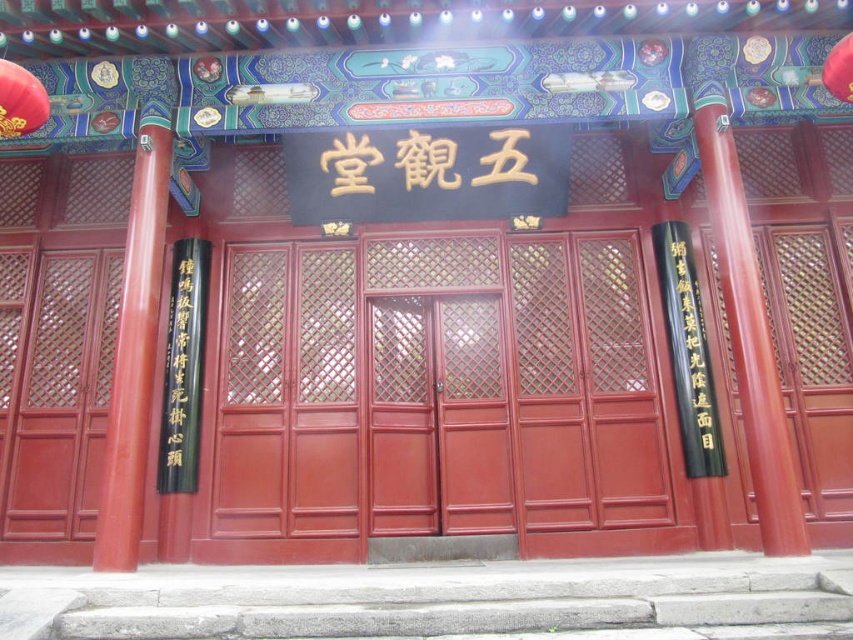
Question: Can you confirm if matte wood door at center is positioned to the left of glossy wood pillar at right?

Choices:
 (A) no
 (B) yes

Answer: (B)

Question: Among these objects, which one is farthest from the camera?

Choices:
 (A) black paper writing at right
 (B) smooth red pillar at left
 (C) glossy wood pillar at right

Answer: (A)

Question: Which point appears farthest from the camera in this image?

Choices:
 (A) (39, 81)
 (B) (381, 404)
 (C) (103, 508)
 (D) (740, 400)

Answer: (B)

Question: Does glossy wood pillar at right have a larger size compared to black paper writing at right?

Choices:
 (A) yes
 (B) no

Answer: (A)

Question: Does glossy wood pillar at right have a smaller size compared to smooth red pillar at left?

Choices:
 (A) no
 (B) yes

Answer: (A)

Question: Which of the following is the farthest from the observer?

Choices:
 (A) matte red paper lantern at upper left
 (B) black paper with gold characters at left

Answer: (B)